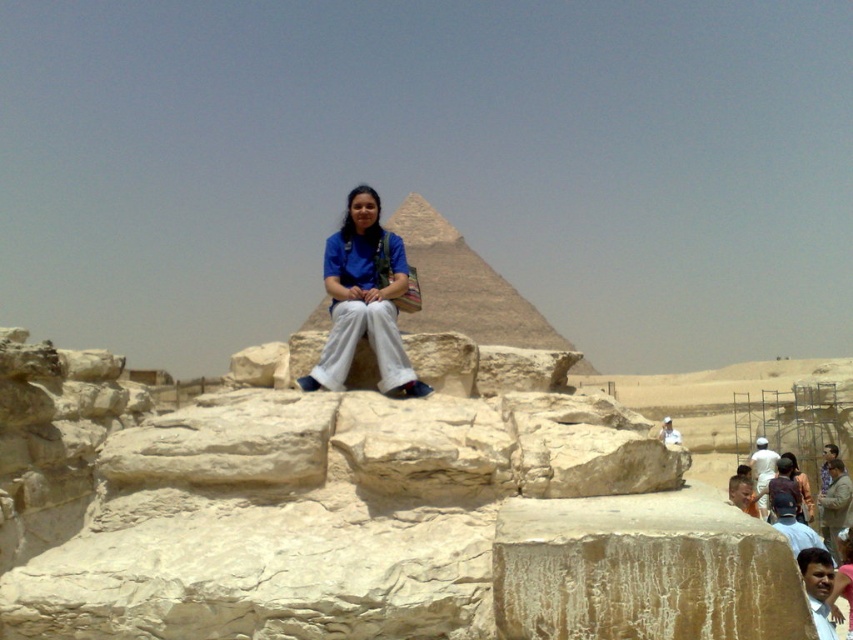
You are a photographer trying to capture the person sitting on the stone block at the Great Pyramid of Giza. In the image, you notice the blue fabric shirt at center and the smooth skin face at center. Which object is located more to the left?

The blue fabric shirt at center is positioned on the left side of smooth skin face at center, so the blue fabric shirt at center is more to the left.

What is the location of the point with coordinates (817,588) in the image?

The point with coordinates (817,588) is located on the smooth skin face at center.